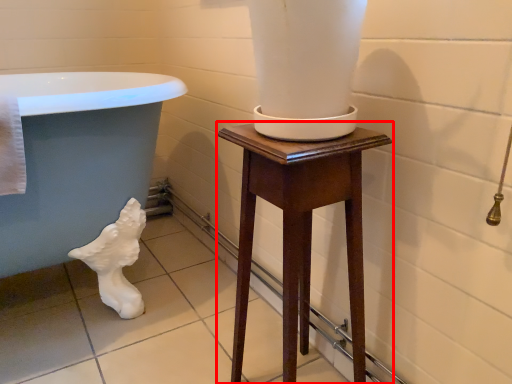
Question: From the image's perspective, where is furniture (annotated by the red box) located in relation to bath in the image?

Choices:
 (A) above
 (B) below

Answer: (B)